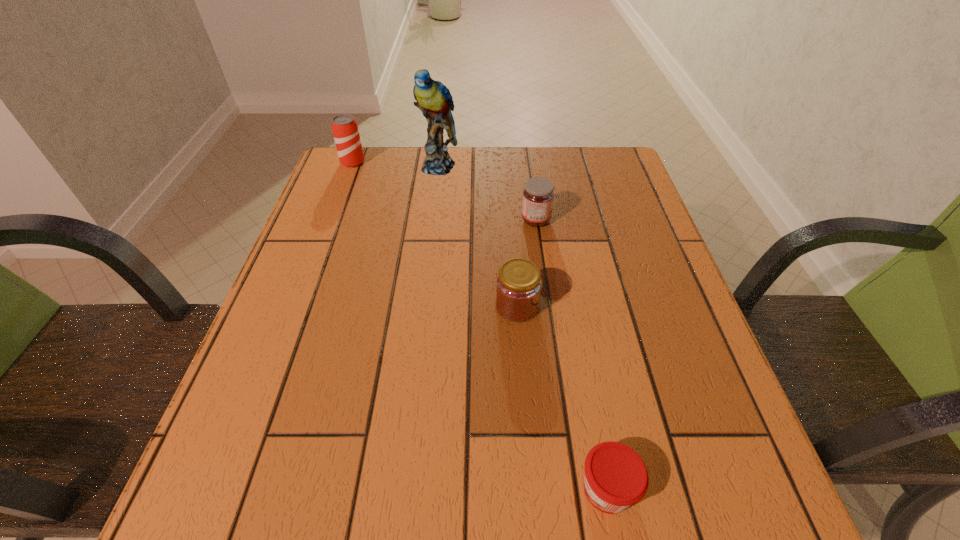
Locate an element on the screen. free space between the second nearest object and the nearest object is located at coordinates (562, 397).

Locate an element on the screen. The width and height of the screenshot is (960, 540). free space that is in between the second nearest object and the second object from left to right is located at coordinates (477, 236).

Locate an element on the screen. free space between the second tallest object and the shortest object is located at coordinates (480, 326).

Locate an element on the screen. This screenshot has height=540, width=960. object that is the second closest to the leftmost object is located at coordinates point(538,195).

This screenshot has width=960, height=540. In order to click on the second closest object to the nearest jam in this screenshot , I will do `click(538, 195)`.

Point out which jam is positioned as the second nearest to the parrot. Please provide its 2D coordinates. Your answer should be formatted as a tuple, i.e. [(x, y)], where the tuple contains the x and y coordinates of a point satisfying the conditions above.

[(518, 288)]

Identify the location of the second closest jam relative to the second object from left to right. (518, 288).

Locate an element on the screen. The image size is (960, 540). vacant space that satisfies the following two spatial constraints: 1. on the face of the parrot; 2. on the right side of the third farthest object is located at coordinates (432, 220).

Locate an element on the screen. The image size is (960, 540). vacant area that satisfies the following two spatial constraints: 1. on the face of the parrot; 2. on the left side of the second farthest jam is located at coordinates (421, 306).

I want to click on free point that satisfies the following two spatial constraints: 1. on the front side of the leftmost object; 2. on the left side of the second nearest jam, so click(300, 306).